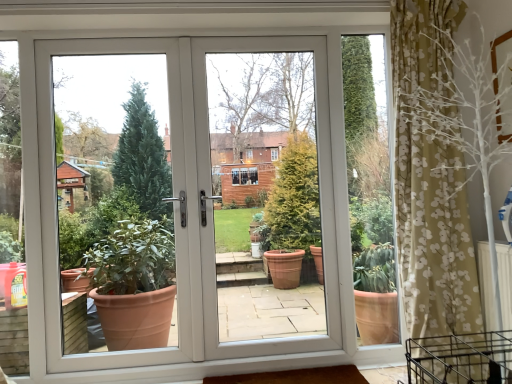
Question: From a real-world perspective, relative to white plastic door at center, is white plastic door at center vertically above or below?

Choices:
 (A) above
 (B) below

Answer: (A)

Question: Choose the correct answer: Is white plastic door at center inside white plastic door at center or outside it?

Choices:
 (A) inside
 (B) outside

Answer: (A)

Question: Looking at their shapes, would you say white plastic door at center is wider or thinner than white plastic door at center?

Choices:
 (A) thin
 (B) wide

Answer: (A)

Question: Visually, is white plastic door at center positioned to the left or to the right of white plastic door at center?

Choices:
 (A) right
 (B) left

Answer: (B)

Question: Is white plastic door at center bigger or smaller than white plastic door at center?

Choices:
 (A) big
 (B) small

Answer: (A)

Question: Would you say white plastic door at center is inside or outside white plastic door at center?

Choices:
 (A) inside
 (B) outside

Answer: (B)

Question: In terms of height, does white plastic door at center look taller or shorter compared to white plastic door at center?

Choices:
 (A) tall
 (B) short

Answer: (B)